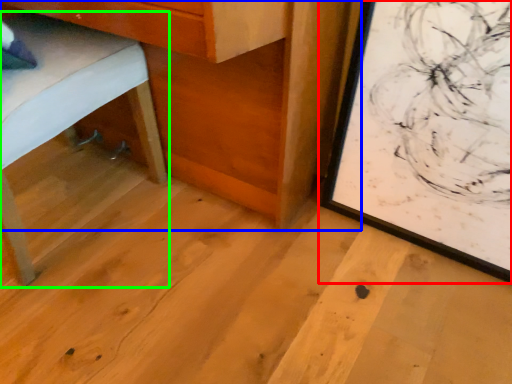
Question: Which object is the farthest from picture frame (highlighted by a red box)? Choose among these: table (highlighted by a blue box) or furniture (highlighted by a green box).

Choices:
 (A) table
 (B) furniture

Answer: (B)